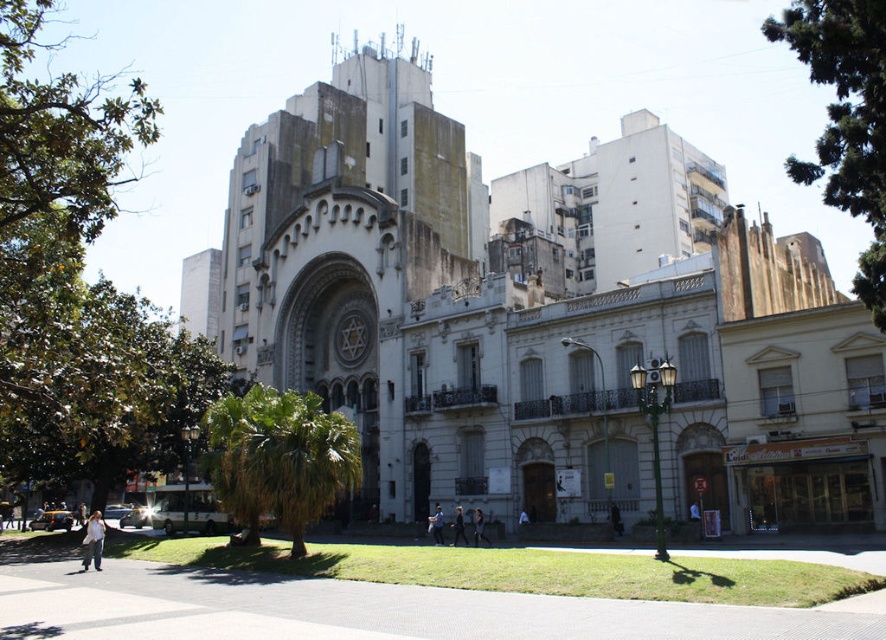
You are standing in front of the historic building and see two jackets hanging on a rack at the center. The dark brown leather jacket at center and the black leather jacket at center. Which jacket is positioned to the right when facing the building?

The dark brown leather jacket at center is positioned to the right of the black leather jacket at center when facing the building.